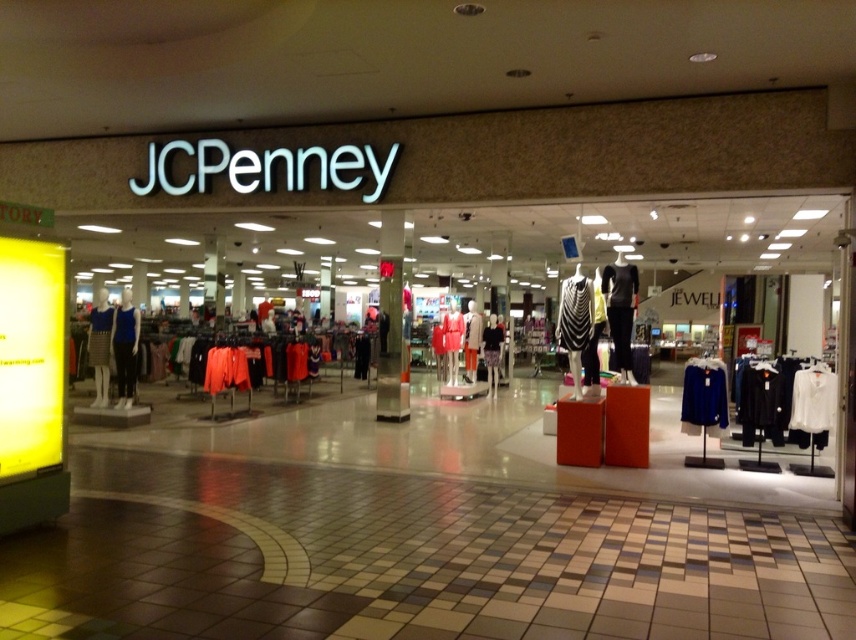
You are a customer standing at the entrance of the JCPenney store and see both the white matte shirt at center and the black matte dress at center. Which item is closer to you?

The white matte shirt at center is closer to you because it is in front of the black matte dress at center.

From the picture: You are standing at the entrance of the JCPenney store and want to take a photo of the mannequin displays. If your camera has a focal length of 50mm and you want to capture the entire store from your current position, will the point at coordinates point (x=804, y=374) be within the camera frame?

The point at coordinates point (x=804, y=374) is 7.44 meters away from the camera. To determine if it fits within the frame, we need to calculate the field of view. With a 50mm lens on a full frame sensor, the diagonal field of view is approximately 46 degrees. Using trigonometry, the maximum distance covered by the frame would be calculated as distance multiplied by tan half the angle. However, without knowing the exact dimensions of the store or the camera sensor size, it is impossible to definitively state

You are standing at the entrance of the JCPenney store facing the interior. Where is the white matte shirt at center located in relation to your position?

The white matte shirt at center is located at the bottom right of the entrance since its 2D coordinates are at point (812, 406).